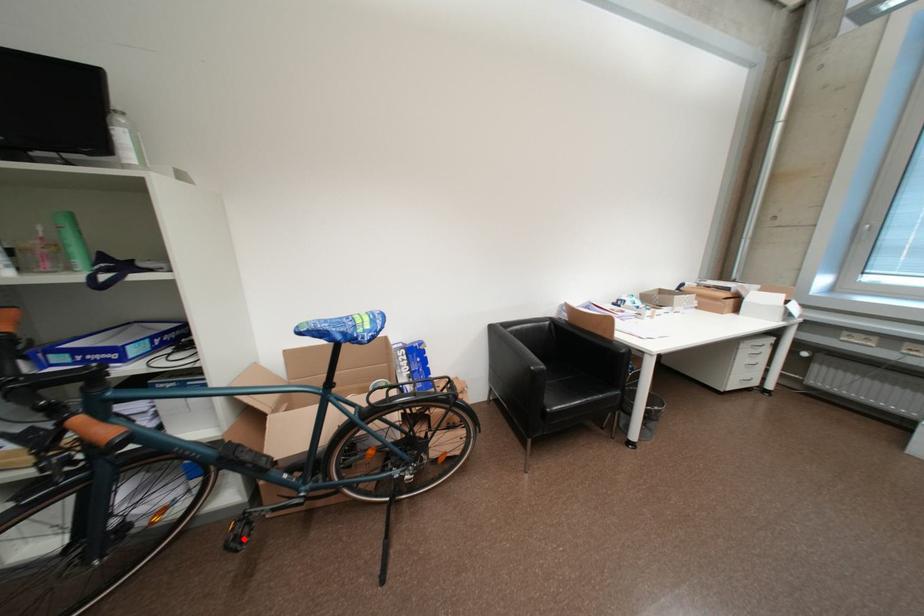
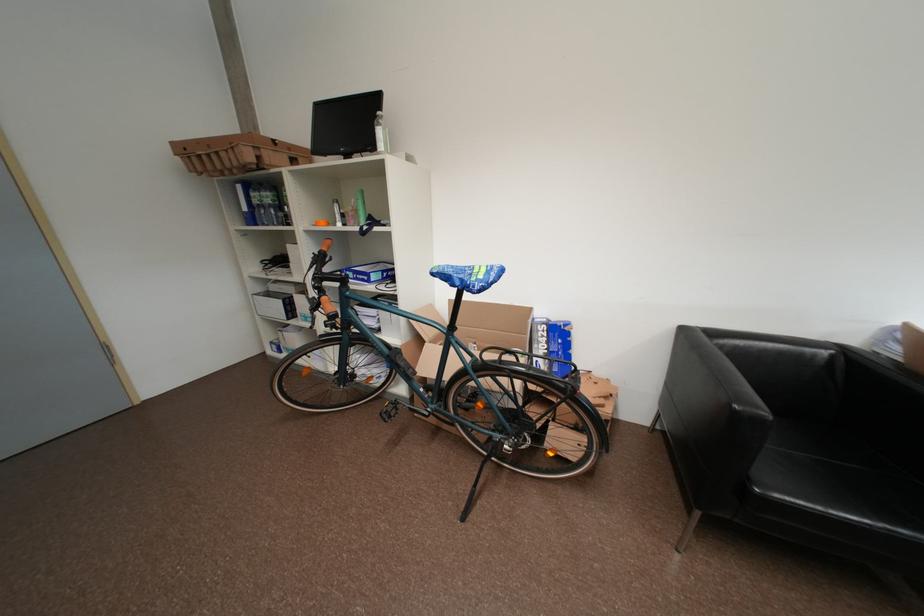
In the second image, find the point that corresponds to the highlighted location in the first image.

(395, 414)